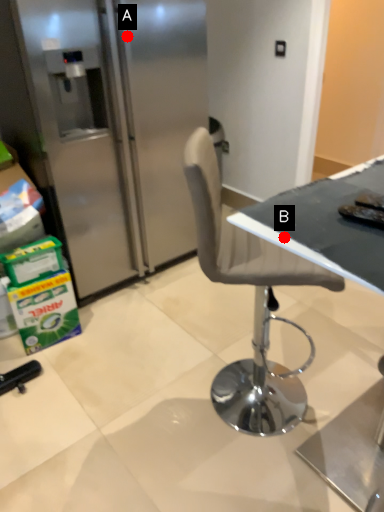
Question: Two points are circled on the image, labeled by A and B beside each circle. Which point is farther to the camera?

Choices:
 (A) A is further
 (B) B is further

Answer: (A)